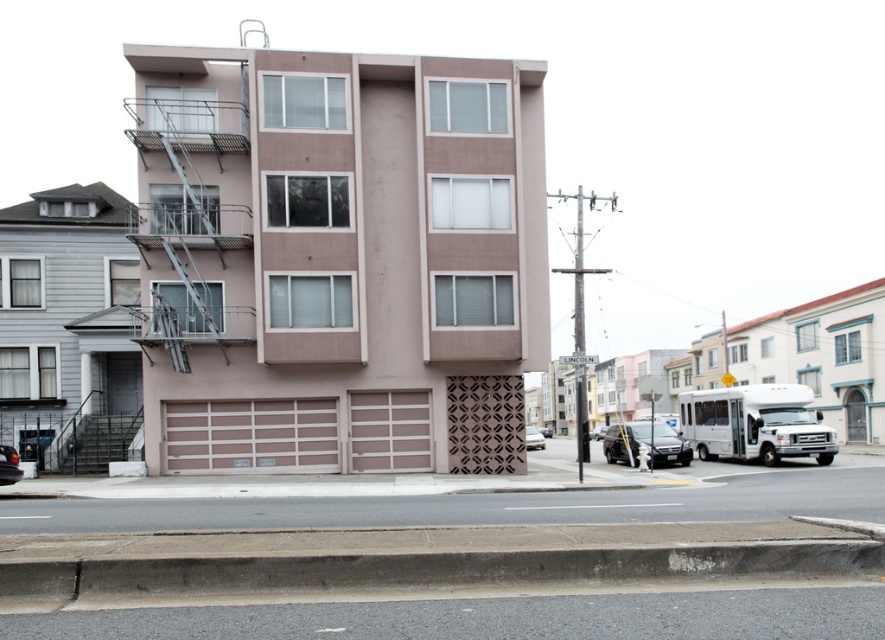
Question: Is metallic silver fire escape at left below silver metallic sedan at center?

Choices:
 (A) no
 (B) yes

Answer: (A)

Question: Which point appears closest to the camera in this image?

Choices:
 (A) (624, 433)
 (B) (174, 333)
 (C) (656, 577)
 (D) (537, 429)

Answer: (C)

Question: Which object appears farthest from the camera in this image?

Choices:
 (A) matte black sedan at lower right
 (B) black glossy car at center
 (C) silver metallic sedan at center

Answer: (C)

Question: Is metallic silver fire escape at left positioned behind black glossy car at center?

Choices:
 (A) no
 (B) yes

Answer: (B)

Question: Which point is farther to the camera?

Choices:
 (A) black glossy car at center
 (B) matte black sedan at lower right
 (C) silver metallic sedan at center

Answer: (C)

Question: Is concrete at lower center below silver metallic sedan at center?

Choices:
 (A) no
 (B) yes

Answer: (A)